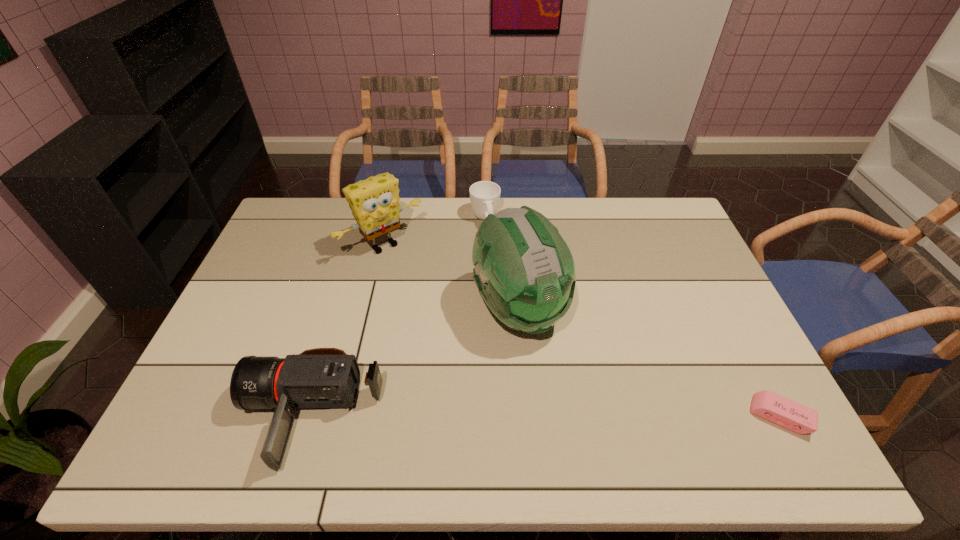
This screenshot has height=540, width=960. I want to click on free space located on the face of the second tallest object, so click(432, 292).

At what (x,y) coordinates should I click in order to perform the action: click on blank area located on the face of the second tallest object. Please return your answer as a coordinate pair (x, y). Image resolution: width=960 pixels, height=540 pixels. Looking at the image, I should click on (452, 314).

At what (x,y) coordinates should I click in order to perform the action: click on free space located 0.120m on the visor of the tallest object. Please return your answer as a coordinate pair (x, y). Looking at the image, I should click on (562, 386).

This screenshot has height=540, width=960. What are the coordinates of `free space located 0.160m on the visor of the tallest object` in the screenshot? It's located at (570, 399).

Image resolution: width=960 pixels, height=540 pixels. In order to click on vacant space situated on the visor of the tallest object in this screenshot , I will do `click(570, 399)`.

Image resolution: width=960 pixels, height=540 pixels. I want to click on vacant space located 0.110m with the handle on the side of the cup, so click(x=495, y=252).

At what (x,y) coordinates should I click in order to perform the action: click on vacant space located 0.270m with the handle on the side of the cup. Please return your answer as a coordinate pair (x, y). Image resolution: width=960 pixels, height=540 pixels. Looking at the image, I should click on (507, 286).

Locate an element on the screen. The image size is (960, 540). vacant area situated with the handle on the side of the cup is located at coordinates (492, 242).

This screenshot has width=960, height=540. Find the location of `sponge that is at the far edge`. sponge that is at the far edge is located at coordinates (374, 202).

Locate an element on the screen. The height and width of the screenshot is (540, 960). cup that is at the far edge is located at coordinates (484, 195).